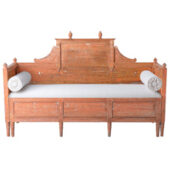
At what (x,y) coordinates should I click in order to perform the action: click on bench top. Please return your answer as a coordinate pair (x, y). Image resolution: width=170 pixels, height=170 pixels. Looking at the image, I should click on (85, 53).